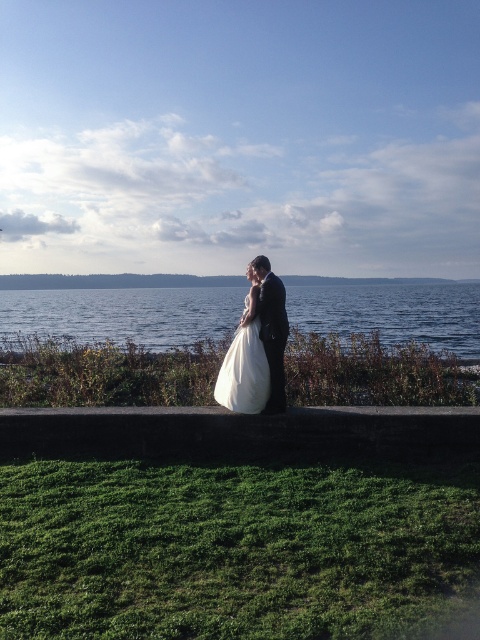
Question: Based on their relative distances, which object is farther from the white satin dress at center?

Choices:
 (A) satin black suit at center
 (B) dark gray concrete ledge at center

Answer: (B)

Question: Based on their relative distances, which object is farther from the satin black suit at center?

Choices:
 (A) blue water at center
 (B) white satin dress at center
 (C) dark gray concrete ledge at center

Answer: (A)

Question: From the image, what is the correct spatial relationship of blue water at center in relation to satin black suit at center?

Choices:
 (A) left
 (B) right

Answer: (B)

Question: Is dark gray concrete ledge at center to the left of blue water at center from the viewer's perspective?

Choices:
 (A) no
 (B) yes

Answer: (B)

Question: Which of the following is the closest to the observer?

Choices:
 (A) blue water at center
 (B) dark gray concrete ledge at center
 (C) white satin dress at center

Answer: (B)

Question: In this image, where is blue water at center located relative to satin black suit at center?

Choices:
 (A) right
 (B) left

Answer: (A)